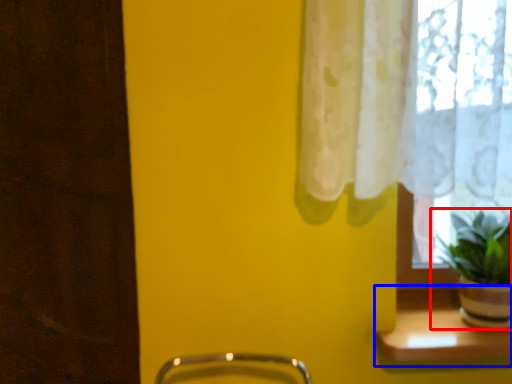
Question: Which point is further to the camera, houseplant (highlighted by a red box) or window sill (highlighted by a blue box)?

Choices:
 (A) houseplant
 (B) window sill

Answer: (B)